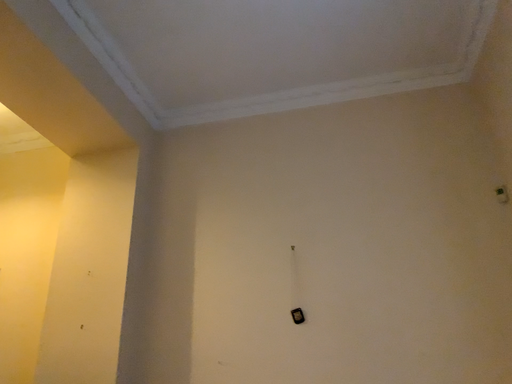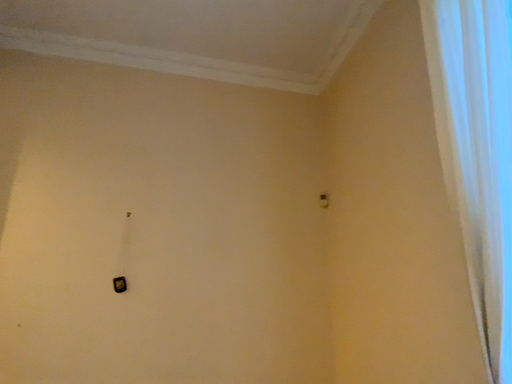
Question: Which way did the camera rotate in the video?

Choices:
 (A) rotated right
 (B) rotated left

Answer: (A)